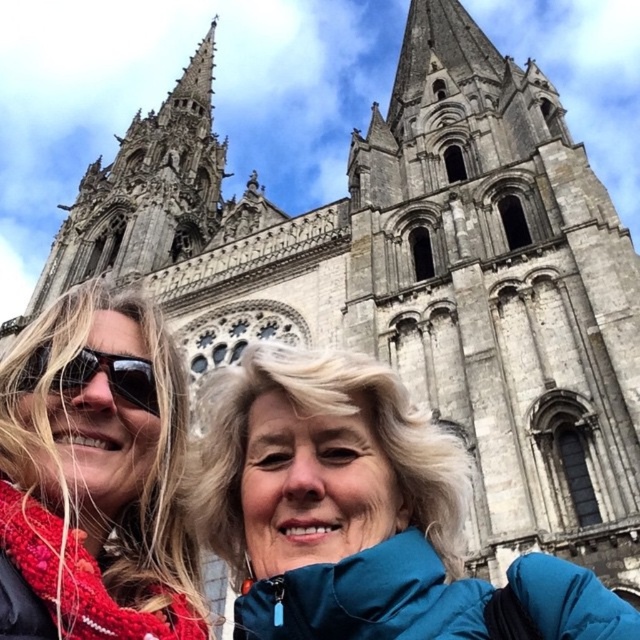
Question: Which point is closer to the camera?

Choices:
 (A) matte red scarf at lower left
 (B) blue fabric jacket at center
 (C) black plastic goggles at left

Answer: (A)

Question: Can you confirm if matte red scarf at lower left is positioned to the right of black plastic goggles at left?

Choices:
 (A) yes
 (B) no

Answer: (B)

Question: Is blue fabric jacket at center behind black plastic goggles at left?

Choices:
 (A) yes
 (B) no

Answer: (B)

Question: Which point is closer to the camera taking this photo?

Choices:
 (A) (348, 490)
 (B) (76, 390)

Answer: (B)

Question: Is matte red scarf at lower left wider than black plastic goggles at left?

Choices:
 (A) yes
 (B) no

Answer: (A)

Question: Among these points, which one is farthest from the camera?

Choices:
 (A) (24, 600)
 (B) (64, 396)
 (C) (419, 531)

Answer: (C)